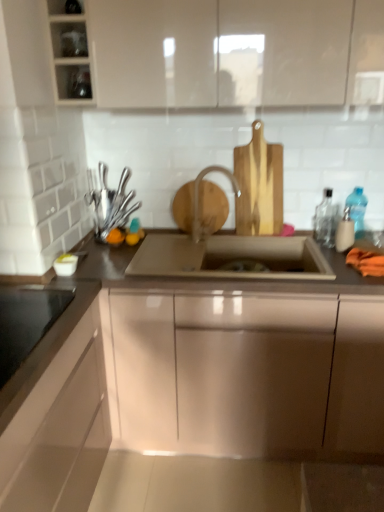
Find the location of a particular element. The image size is (384, 512). vacant area to the left of translucent plastic soap dispenser at right, which is the 2th bottle in left-to-right order is located at coordinates 316,249.